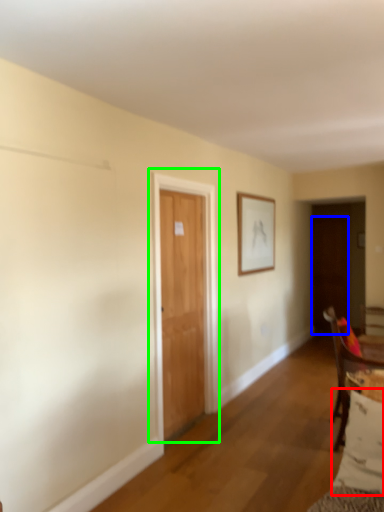
Question: Based on their relative distances, which object is farther from pillow (highlighted by a red box)? Choose from door (highlighted by a blue box) and door (highlighted by a green box).

Choices:
 (A) door
 (B) door

Answer: (A)